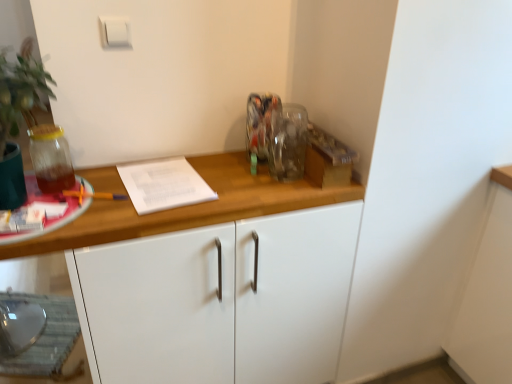
Where is `free space above white matte cabinet at center (from a real-world perspective)`? Image resolution: width=512 pixels, height=384 pixels. free space above white matte cabinet at center (from a real-world perspective) is located at coordinates (192, 183).